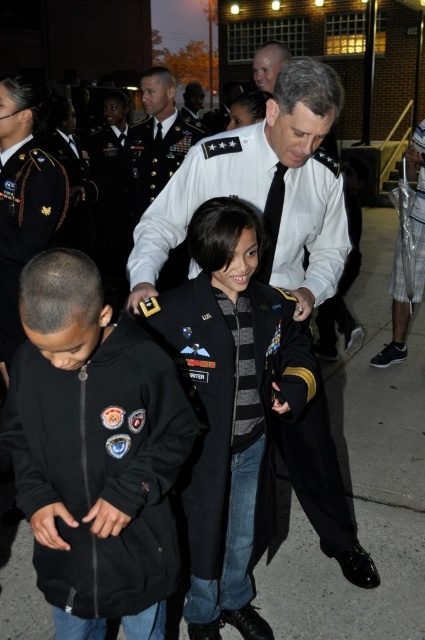
Question: Considering the relative positions of dark blue wool jacket at center and silver metallic umbrella at upper right in the image provided, where is dark blue wool jacket at center located with respect to silver metallic umbrella at upper right?

Choices:
 (A) right
 (B) left

Answer: (B)

Question: Which point appears closest to the camera in this image?

Choices:
 (A) (274, 490)
 (B) (197, 147)
 (C) (331, 241)
 (D) (416, 182)

Answer: (A)

Question: Can you confirm if dark green uniform at center is smaller than silver metallic umbrella at upper right?

Choices:
 (A) yes
 (B) no

Answer: (B)

Question: Which point appears closest to the camera in this image?

Choices:
 (A) (144, 120)
 (B) (161, 198)

Answer: (B)

Question: Which object is farther from the camera taking this photo?

Choices:
 (A) dark green uniform at center
 (B) dark green fabric military uniform at left
 (C) white glossy uniform at center
 (D) smooth bald head at upper center

Answer: (A)

Question: Is white uniform at center thinner than white glossy uniform at center?

Choices:
 (A) yes
 (B) no

Answer: (B)